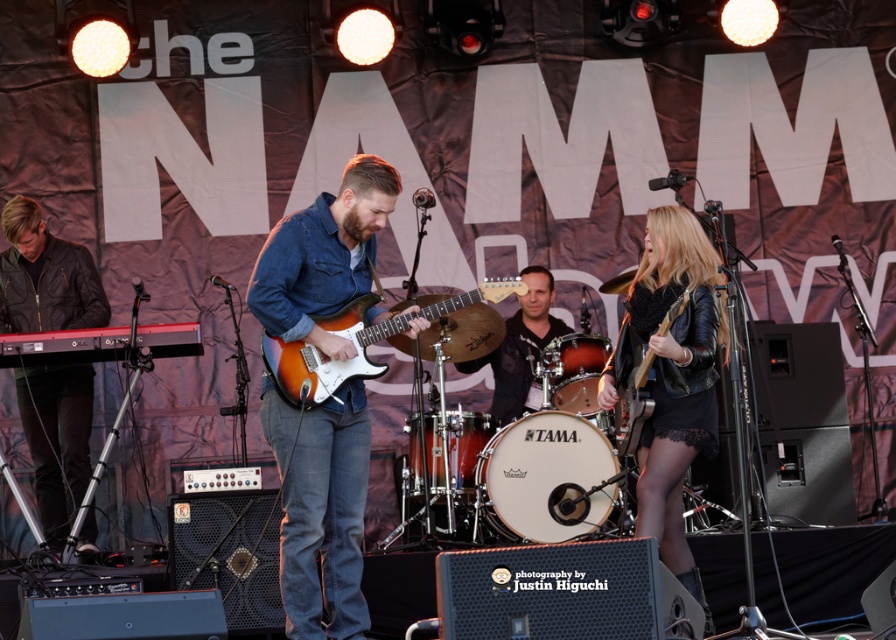
Question: Which object is positioned farthest from the white drumhead at center?

Choices:
 (A) orange wood electric guitar at center
 (B) black leather jacket at center
 (C) matte black guitar at center
 (D) matte red drum at center

Answer: (A)

Question: Does denim jacket at center appear over shiny black guitar at center?

Choices:
 (A) no
 (B) yes

Answer: (B)

Question: Can you confirm if white drumhead at center is positioned to the left of shiny black guitar at center?

Choices:
 (A) yes
 (B) no

Answer: (A)

Question: Which point is farther to the camera?

Choices:
 (A) matte red drum at center
 (B) black leather jacket at center

Answer: (A)

Question: Among these points, which one is nearest to the camera?

Choices:
 (A) (509, 336)
 (B) (341, 376)
 (C) (412, 456)

Answer: (B)

Question: Is black leather jacket at left behind matte black guitar at center?

Choices:
 (A) no
 (B) yes

Answer: (A)